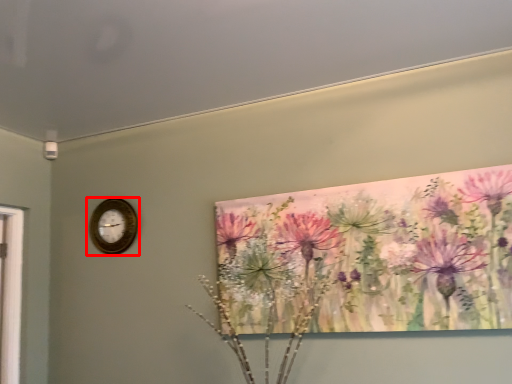
Question: From the image, what is the correct spatial relationship of wall clock (annotated by the red box) in relation to flower?

Choices:
 (A) right
 (B) left

Answer: (B)